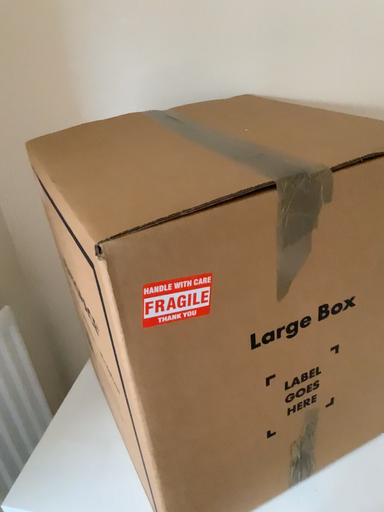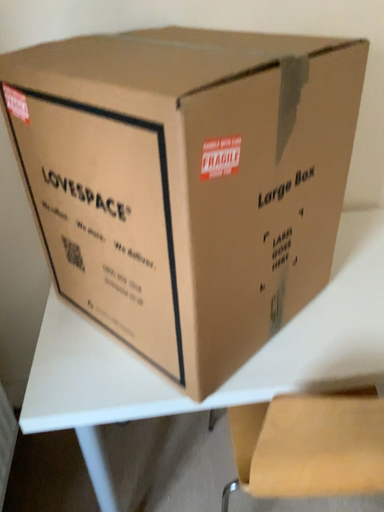
Question: How did the camera likely rotate when shooting the video?

Choices:
 (A) rotated right
 (B) rotated left

Answer: (A)